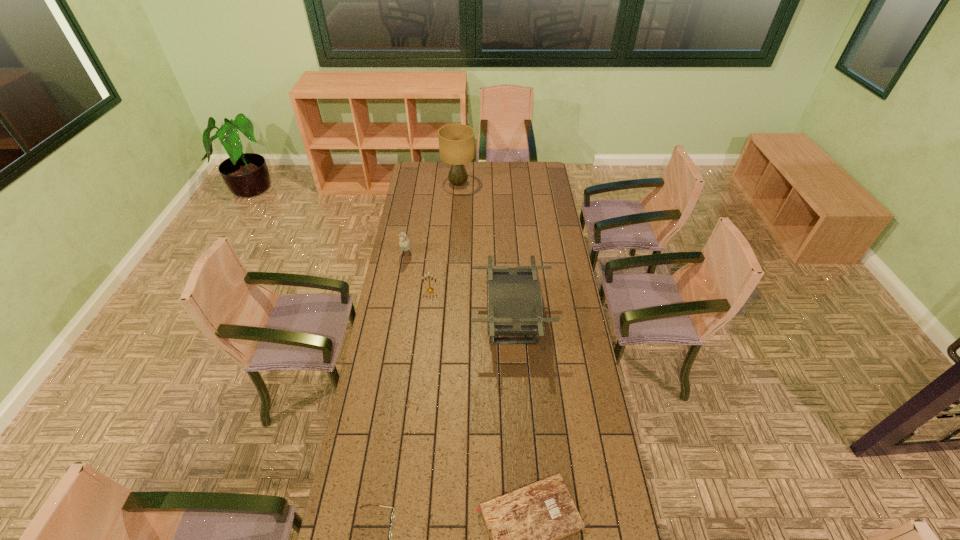
At what (x,y) coordinates should I click in order to perform the action: click on the tallest object. Please return your answer as a coordinate pair (x, y). Looking at the image, I should click on (456, 141).

Where is `the farthest object`? the farthest object is located at coordinates (456, 141).

Find the location of a particular element. The image size is (960, 540). drone is located at coordinates (514, 299).

This screenshot has width=960, height=540. In order to click on bird in this screenshot , I will do `click(404, 242)`.

Image resolution: width=960 pixels, height=540 pixels. I want to click on the third tallest object, so click(404, 242).

This screenshot has width=960, height=540. Find the location of `the fourth tallest object`. the fourth tallest object is located at coordinates (429, 290).

Where is `free location located on the front of the tallest object`? This screenshot has width=960, height=540. free location located on the front of the tallest object is located at coordinates (457, 208).

Where is `free location located 0.240m with a camera mounted on the underside of the fifth shortest object`? Image resolution: width=960 pixels, height=540 pixels. free location located 0.240m with a camera mounted on the underside of the fifth shortest object is located at coordinates (419, 321).

You are a GUI agent. You are given a task and a screenshot of the screen. Output one action in this format:
    pyautogui.click(x=<x>, y=<y>)
    Task: Click on the vacant space located 0.230m with a camera mounted on the underside of the fifth shortest object
    Image resolution: width=960 pixels, height=540 pixels.
    Given the screenshot: What is the action you would take?
    pyautogui.click(x=420, y=321)

I want to click on vacant space situated 0.250m with a camera mounted on the underside of the fifth shortest object, so coord(417,321).